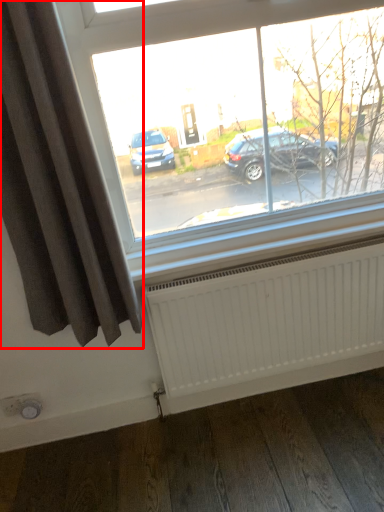
Question: In this image, where is curtain (annotated by the red box) located relative to radiator?

Choices:
 (A) right
 (B) left

Answer: (B)